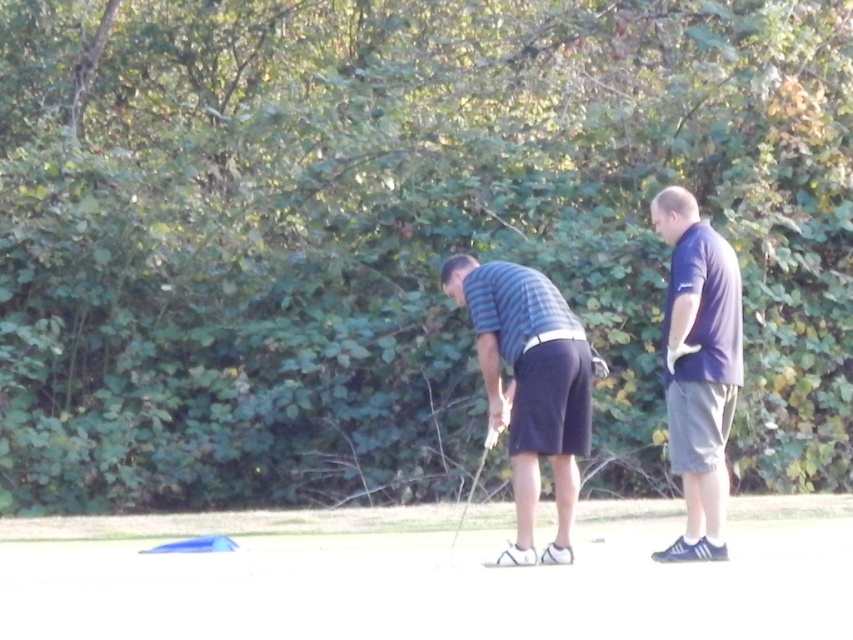
Question: Which point is farther to the camera?

Choices:
 (A) (3, 625)
 (B) (724, 381)
 (C) (490, 435)
 (D) (578, 323)

Answer: (D)

Question: Is white smooth sand at lower center further to the viewer compared to dark blue shirt at right?

Choices:
 (A) no
 (B) yes

Answer: (A)

Question: Which object is positioned farthest from the white smooth sand at lower center?

Choices:
 (A) metallic silver golf club at center
 (B) dark blue shirt at right
 (C) striped cotton shirt at center

Answer: (B)

Question: Does white smooth sand at lower center have a smaller size compared to metallic silver golf club at center?

Choices:
 (A) yes
 (B) no

Answer: (B)

Question: Which point is farther from the camera taking this photo?

Choices:
 (A) (730, 269)
 (B) (463, 518)
 (C) (509, 301)

Answer: (B)

Question: Can you confirm if white smooth sand at lower center is positioned to the right of striped cotton shirt at center?

Choices:
 (A) yes
 (B) no

Answer: (B)